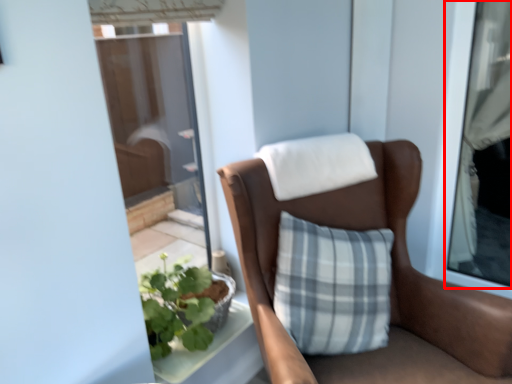
Question: From the image's perspective, where is window (annotated by the red box) located in relation to chair in the image?

Choices:
 (A) below
 (B) above

Answer: (B)